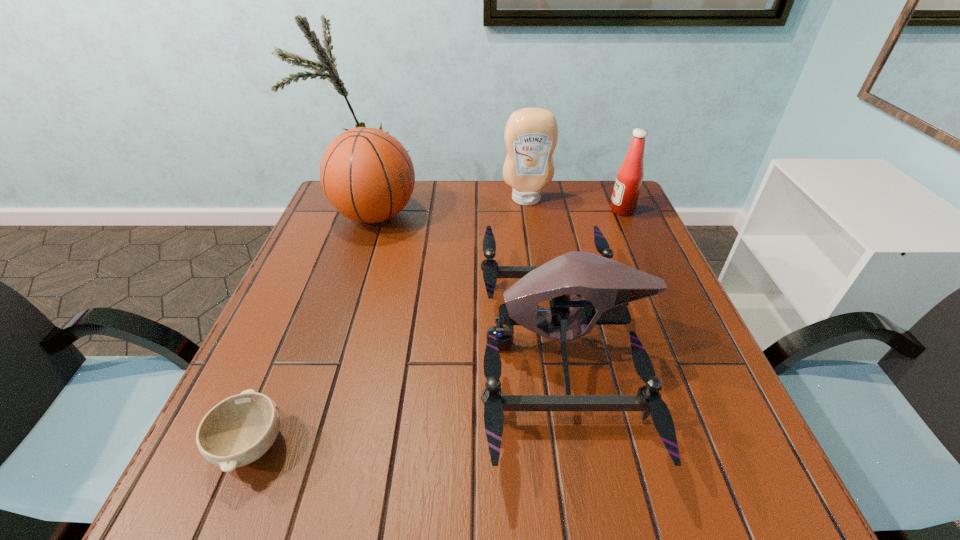
This screenshot has height=540, width=960. Identify the location of vacant region between the bowl and the rightmost object. (437, 328).

Locate an element on the screen. The image size is (960, 540). vacant space in between the right condiment and the basketball is located at coordinates point(498,213).

You are a GUI agent. You are given a task and a screenshot of the screen. Output one action in this format:
    pyautogui.click(x=<x>, y=<y>)
    Task: Click on the unoccupied position between the bowl and the rightmost object
    The image size is (960, 540).
    Given the screenshot: What is the action you would take?
    pyautogui.click(x=437, y=328)

Image resolution: width=960 pixels, height=540 pixels. I want to click on vacant area that lies between the shortest object and the rightmost object, so click(x=437, y=328).

This screenshot has height=540, width=960. Find the location of `empty location between the shortest object and the basketball`. empty location between the shortest object and the basketball is located at coordinates (314, 330).

Identify the location of vacant space that's between the drone and the bowl. coord(407,395).

Find the location of a particular element. This screenshot has width=960, height=540. empty space between the basketball and the shortest object is located at coordinates [314, 330].

The width and height of the screenshot is (960, 540). I want to click on unoccupied position between the right condiment and the left condiment, so click(574, 205).

The image size is (960, 540). I want to click on vacant area that lies between the left condiment and the rightmost object, so click(x=574, y=205).

Select which object appears as the fourth closest to the left condiment. Please provide its 2D coordinates. Your answer should be formatted as a tuple, i.e. [(x, y)], where the tuple contains the x and y coordinates of a point satisfying the conditions above.

[(237, 431)]